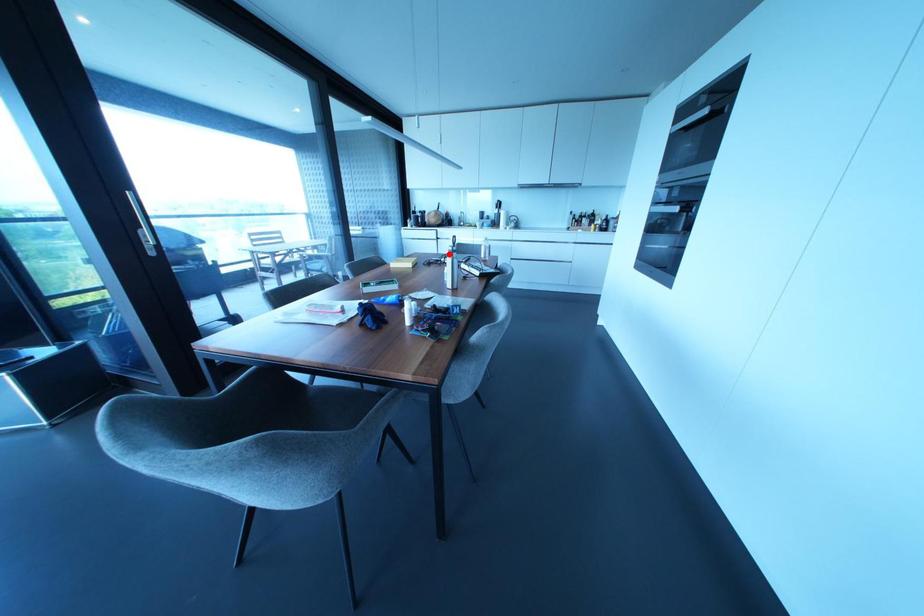
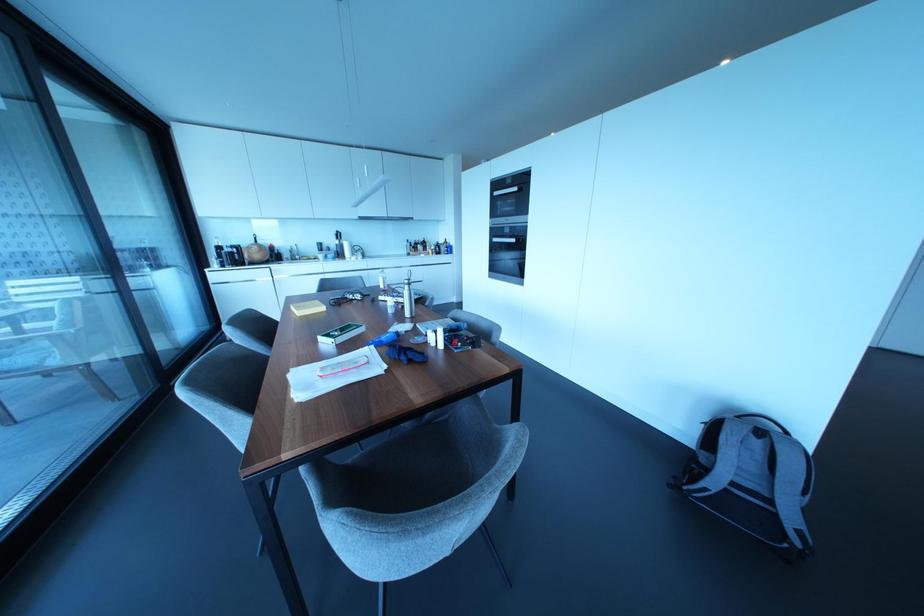
Find the pixel in the second image that matches the highlighted location in the first image.

(406, 286)